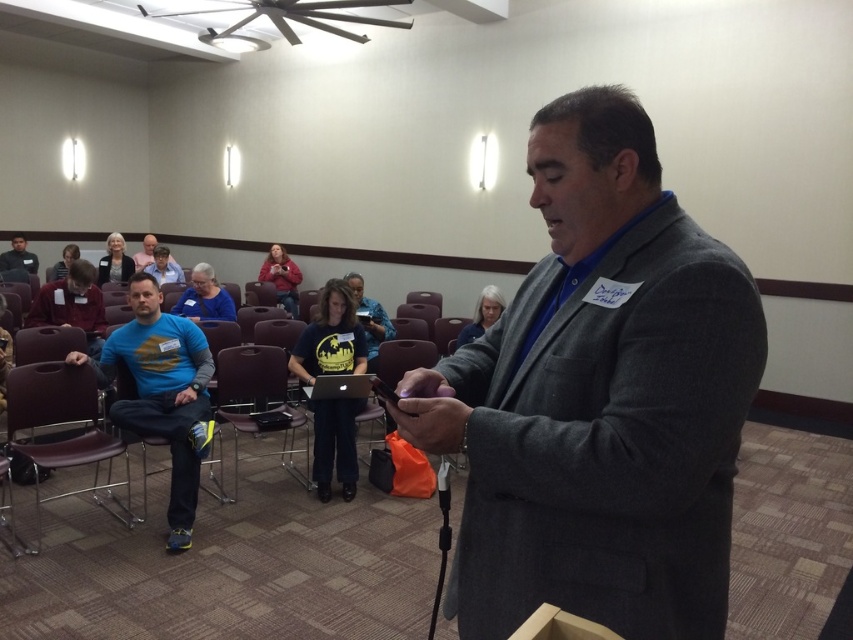
Question: Which object appears closest to the camera in this image?

Choices:
 (A) blue fabric shirt at center
 (B) dark gray shirt at lower left

Answer: (A)

Question: Is gray fabric at center smaller than dark gray sweater at upper center?

Choices:
 (A) yes
 (B) no

Answer: (A)

Question: Can you confirm if blue t-shirt at center is positioned below light brown hair at upper left?

Choices:
 (A) yes
 (B) no

Answer: (A)

Question: Does burgundy plastic chair at lower left lie in front of dark gray sweater at upper center?

Choices:
 (A) no
 (B) yes

Answer: (B)

Question: Among these objects, which one is nearest to the camera?

Choices:
 (A) burgundy plastic chair at lower left
 (B) light brown hair at upper left
 (C) matte red sweater at center

Answer: (A)

Question: Which object is positioned farthest from the dark gray shirt at lower left?

Choices:
 (A) matte red sweater at center
 (B) gray wool suit at center

Answer: (B)